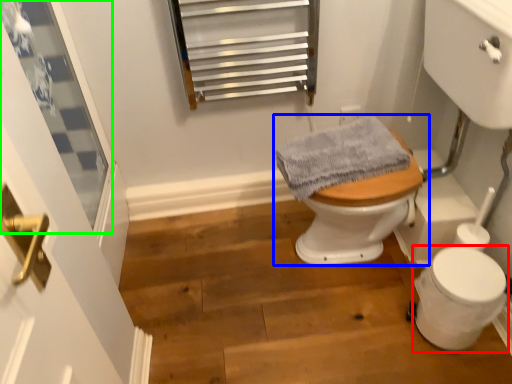
Question: Considering the real-world distances, which object is closest to toilet bowl (highlighted by a red box)? toilet (highlighted by a blue box) or window (highlighted by a green box).

Choices:
 (A) toilet
 (B) window

Answer: (A)